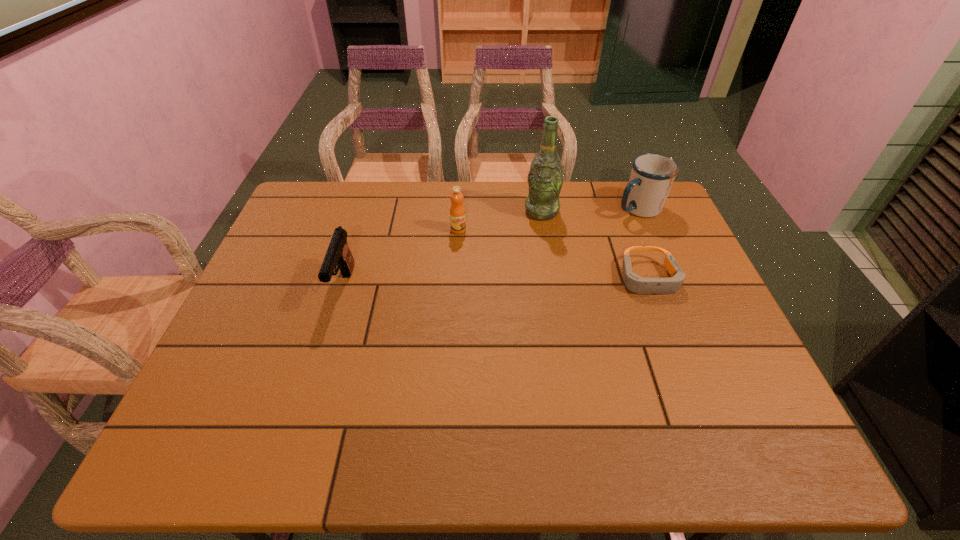
Find the location of a particular element. This screenshot has height=540, width=960. free space located 0.320m on the surface of the tallest object is located at coordinates 509,293.

At what (x,y) coordinates should I click in order to perform the action: click on vacant space located on the surface of the tallest object. Please return your answer as a coordinate pair (x, y). The width and height of the screenshot is (960, 540). Looking at the image, I should click on (528, 245).

Identify the location of vacant space situated on the handle side of the mug. (564, 255).

You are a GUI agent. You are given a task and a screenshot of the screen. Output one action in this format:
    pyautogui.click(x=<x>, y=<y>)
    Task: Click on the free spot located 0.050m on the handle side of the mug
    This screenshot has width=960, height=540.
    Given the screenshot: What is the action you would take?
    pyautogui.click(x=612, y=224)

Locate an element on the screen. This screenshot has width=960, height=540. vacant position located 0.400m on the handle side of the mug is located at coordinates (532, 276).

This screenshot has width=960, height=540. I want to click on free spot located on the front label of the third farthest object, so click(x=461, y=282).

At what (x,y) coordinates should I click in order to perform the action: click on free location located 0.190m on the front label of the third farthest object. Please return your answer as a coordinate pair (x, y). The image size is (960, 540). Looking at the image, I should click on (461, 280).

Locate an element on the screen. This screenshot has height=540, width=960. free spot located on the front label of the third farthest object is located at coordinates [x=461, y=282].

The width and height of the screenshot is (960, 540). I want to click on beer bottle at the far edge, so click(545, 179).

Image resolution: width=960 pixels, height=540 pixels. I want to click on mug that is at the far edge, so (x=652, y=175).